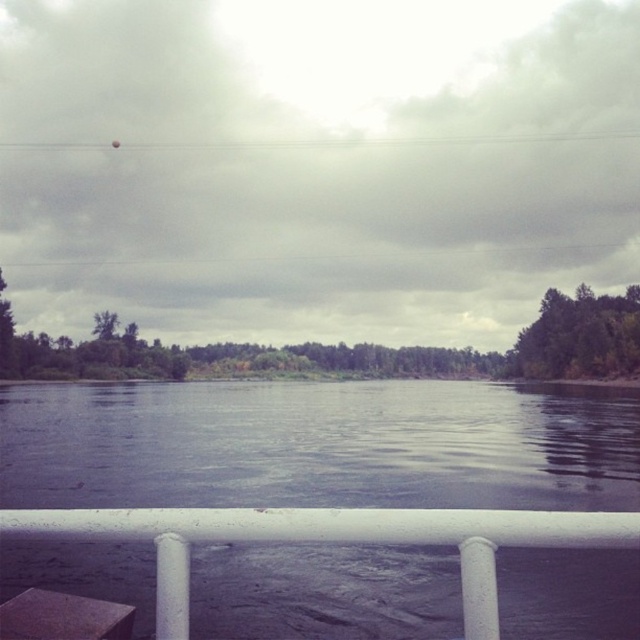
Question: Which object is the closest to the green matte tree at right?

Choices:
 (A) white matte rail at lower center
 (B) green matte tree at upper center

Answer: (B)

Question: Does green matte tree at right appear on the left side of green matte tree at upper center?

Choices:
 (A) yes
 (B) no

Answer: (B)

Question: Does white matte rail at lower center have a greater width compared to green matte tree at upper center?

Choices:
 (A) no
 (B) yes

Answer: (A)

Question: Which point appears farthest from the camera in this image?

Choices:
 (A) (300, 532)
 (B) (536, 337)
 (C) (108, 310)

Answer: (C)

Question: Does white matte rail at lower center come behind green matte tree at right?

Choices:
 (A) yes
 (B) no

Answer: (B)

Question: Which point is closer to the camera?

Choices:
 (A) green matte tree at upper center
 (B) green matte tree at right

Answer: (B)